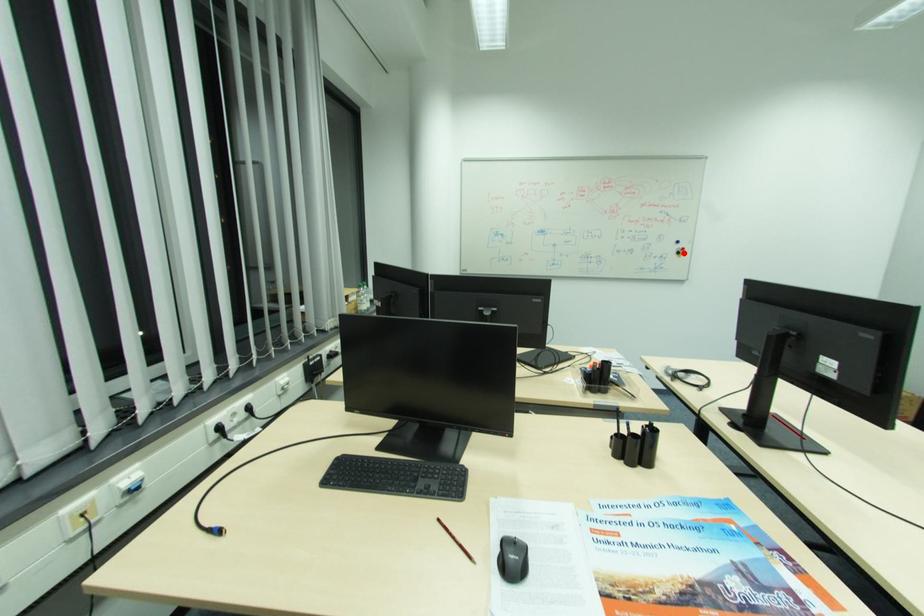
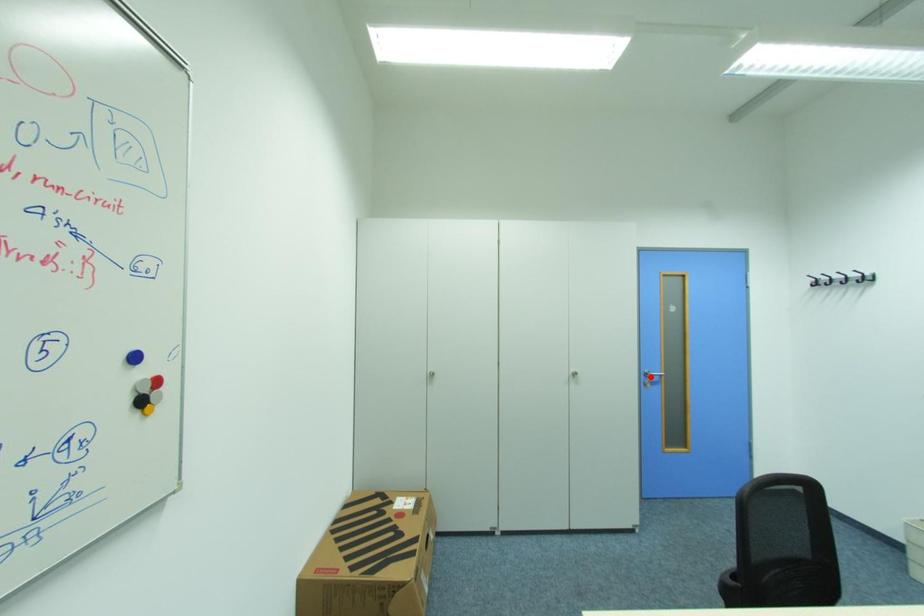
I am providing you with two images of the same scene from different viewpoints. A red point is marked on the first image and another point is marked on the second image. Are the points marked in image1 and image2 representing the same 3D position?

No